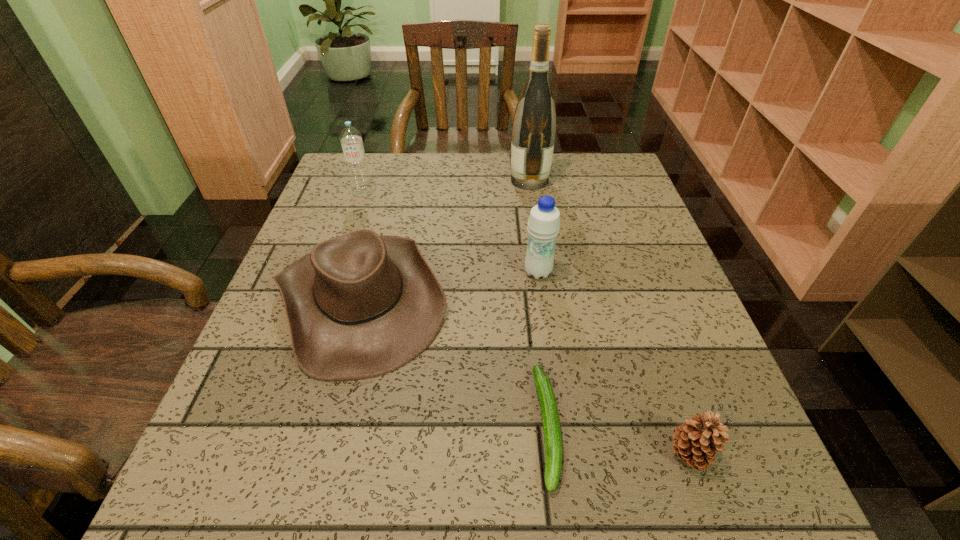
Find the location of `vacant region located 0.330m on the right of the left water bottle`. vacant region located 0.330m on the right of the left water bottle is located at coordinates (497, 192).

The width and height of the screenshot is (960, 540). Identify the location of vacant space located 0.110m on the back of the nearer water bottle. (533, 232).

Where is `free space located 0.120m on the right of the third shortest object`? free space located 0.120m on the right of the third shortest object is located at coordinates (508, 299).

Identify the location of free location located 0.070m on the left of the pinecone. (621, 454).

Identify the location of wine bottle that is at the far edge. The width and height of the screenshot is (960, 540). [534, 125].

Locate an element on the screen. water bottle situated at the far edge is located at coordinates (351, 138).

Where is `pinecone present at the near edge`? pinecone present at the near edge is located at coordinates (696, 442).

Identify the location of zucchini present at the near edge. The height and width of the screenshot is (540, 960). (550, 417).

This screenshot has width=960, height=540. What are the coordinates of `water bottle that is at the left edge` in the screenshot? It's located at (351, 138).

Locate an element on the screen. cowboy hat that is at the left edge is located at coordinates (360, 305).